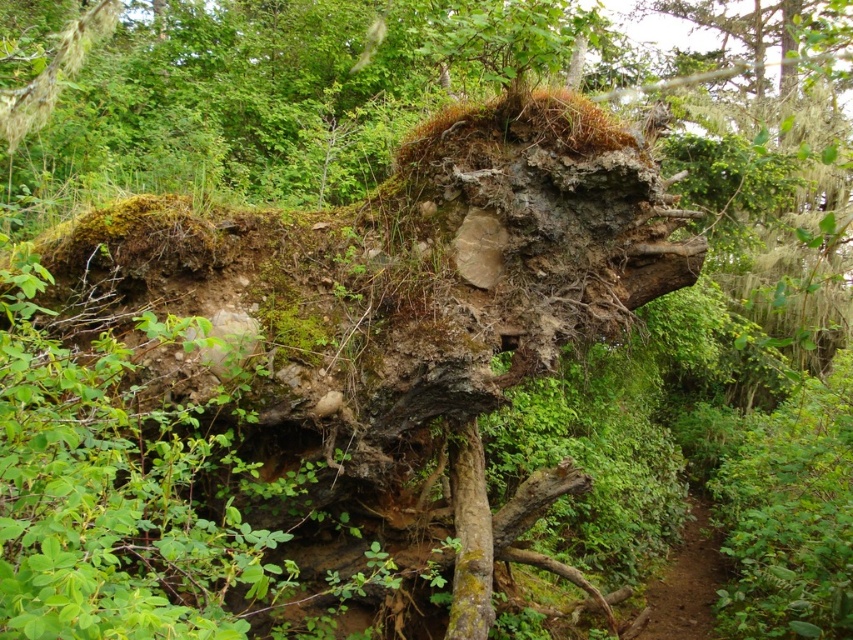
Question: Which object is farther from the camera taking this photo?

Choices:
 (A) brown dirt path at lower right
 (B) green mossy bark at center

Answer: (A)

Question: Does green mossy bark at center have a larger size compared to brown dirt path at lower right?

Choices:
 (A) no
 (B) yes

Answer: (A)

Question: Is green mossy bark at center behind brown dirt path at lower right?

Choices:
 (A) no
 (B) yes

Answer: (A)

Question: Can you confirm if green mossy bark at center is positioned above brown dirt path at lower right?

Choices:
 (A) yes
 (B) no

Answer: (A)

Question: Among these objects, which one is nearest to the camera?

Choices:
 (A) brown dirt path at lower right
 (B) green mossy bark at center

Answer: (B)